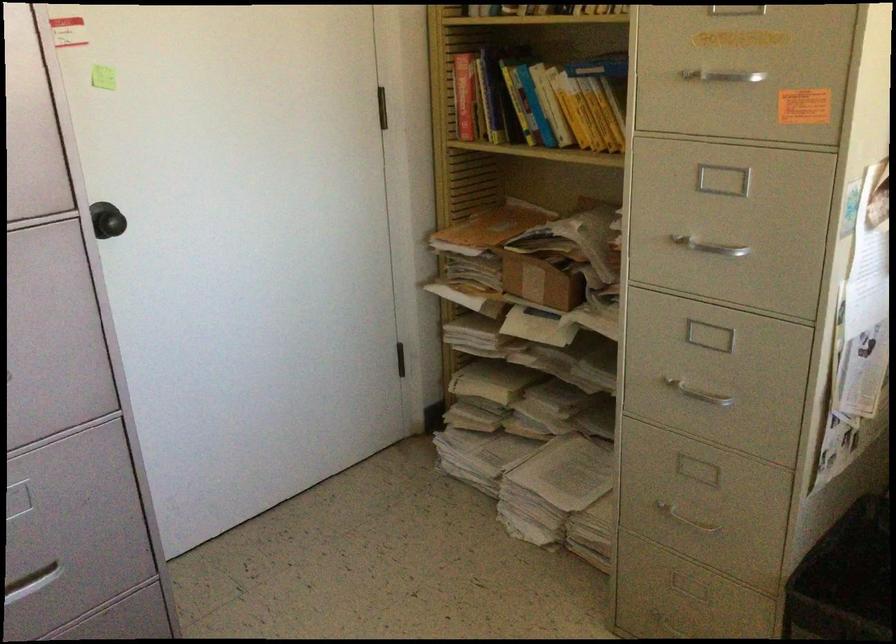
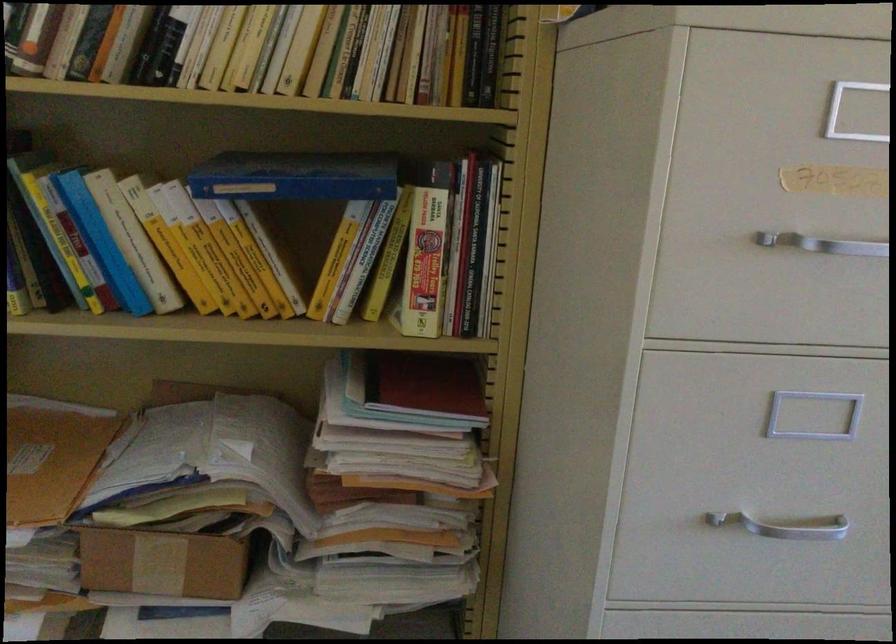
Where in the second image is the point corresponding to point 719,252 from the first image?

(784, 526)